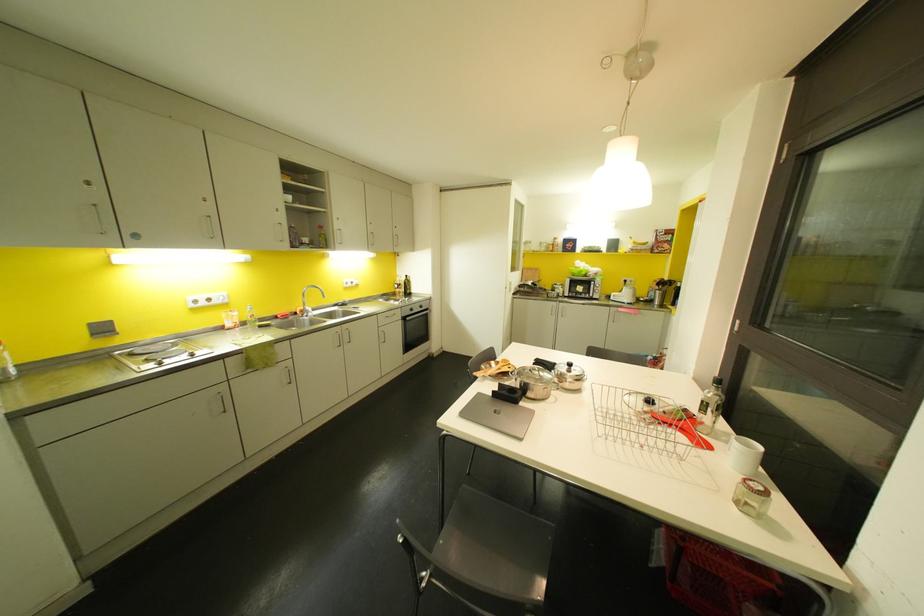
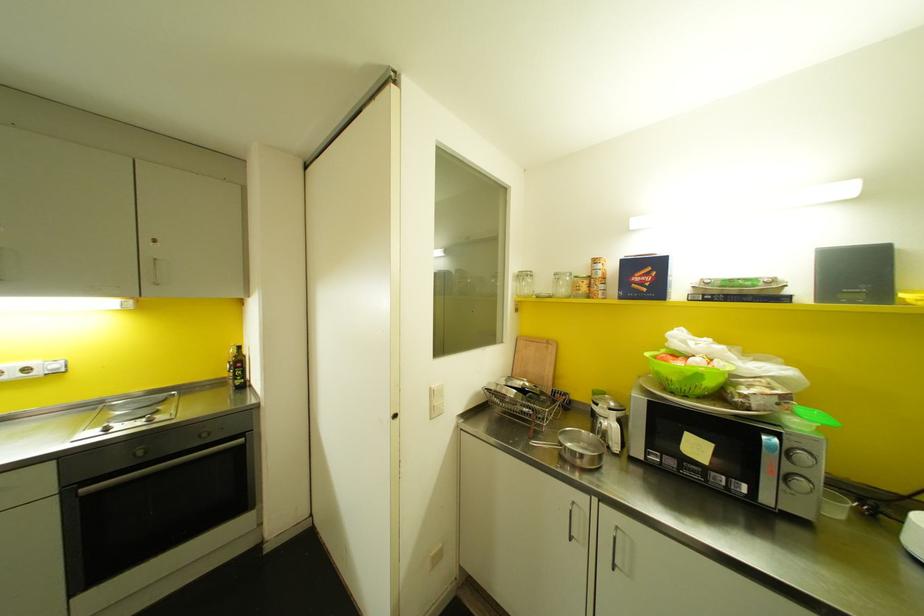
Which direction would the cameraman need to move to produce the second image?

The cameraman walked toward right, forward.